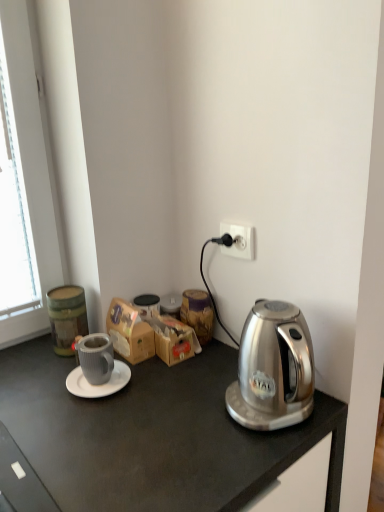
Question: Are wooden jar at center and white matte saucer at center located far from each other?

Choices:
 (A) yes
 (B) no

Answer: (B)

Question: From a real-world perspective, is wooden jar at center below white matte saucer at center?

Choices:
 (A) no
 (B) yes

Answer: (A)

Question: Is white matte saucer at center at the back of wooden jar at center?

Choices:
 (A) yes
 (B) no

Answer: (B)

Question: Can you confirm if wooden jar at center is thinner than white matte saucer at center?

Choices:
 (A) yes
 (B) no

Answer: (A)

Question: Could you tell me if wooden jar at center is facing white matte saucer at center?

Choices:
 (A) yes
 (B) no

Answer: (B)

Question: From the image's perspective, is wooden jar at center under white matte saucer at center?

Choices:
 (A) no
 (B) yes

Answer: (A)

Question: Is brown cardboard box at center positioned with its back to matte gray mug at center left?

Choices:
 (A) yes
 (B) no

Answer: (B)

Question: Considering the relative sizes of brown cardboard box at center and matte gray mug at center left in the image provided, is brown cardboard box at center wider than matte gray mug at center left?

Choices:
 (A) yes
 (B) no

Answer: (B)

Question: Is brown cardboard box at center further to the viewer compared to matte gray mug at center left?

Choices:
 (A) no
 (B) yes

Answer: (B)

Question: Does brown cardboard box at center appear on the left side of matte gray mug at center left?

Choices:
 (A) no
 (B) yes

Answer: (A)

Question: Is matte gray mug at center left completely or partially inside brown cardboard box at center?

Choices:
 (A) no
 (B) yes

Answer: (A)

Question: From a real-world perspective, is brown cardboard box at center below matte gray mug at center left?

Choices:
 (A) yes
 (B) no

Answer: (A)

Question: Does white plastic power outlet at upper right have a lesser width compared to wooden jar at center?

Choices:
 (A) no
 (B) yes

Answer: (B)